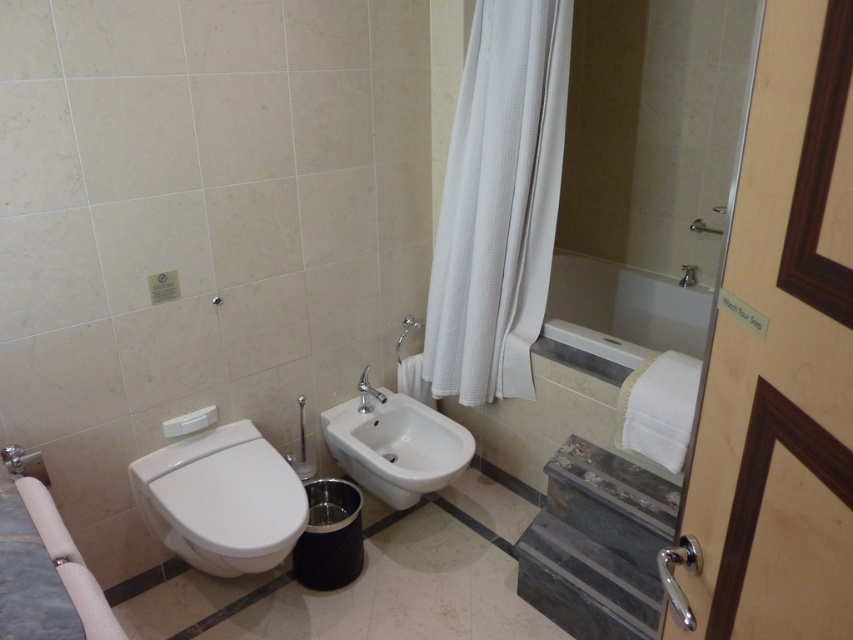
Consider the image. You are standing in the bathroom and need to reach both the white glossy bidet at lower left and the white glossy sink at center. Which one would you approach first if you want to use the one nearest to you?

The white glossy bidet at lower left is closer to the viewer, so you should approach it first.

You are standing in the bathroom and want to reach the white glossy bidet at lower left. Which direction should you move from your current position at point [221,499]?

You are already at the location of the white glossy bidet at lower left, so no movement is needed.

You are designing a layout for a small bathroom and need to place both the white glossy bidet at lower left and the white glossy bathtub at center. Considering their sizes, which one should you prioritize placing first to optimize space?

The white glossy bidet at lower left should be prioritized since it occupies less space than the white glossy bathtub at center, allowing for better space optimization in a small bathroom.